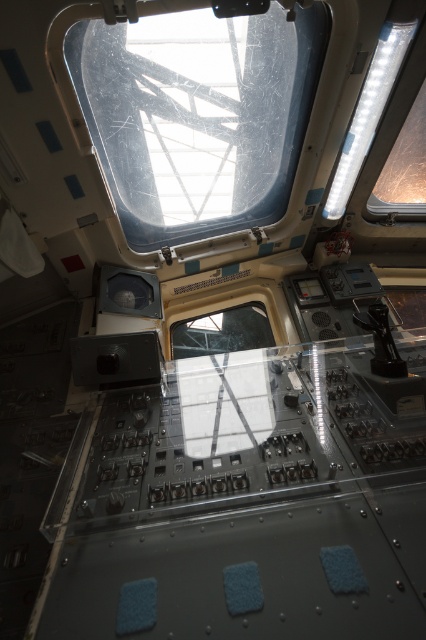
Question: Considering the real-world distances, which object is farthest from the transparent glass window at upper right?

Choices:
 (A) transparent plastic window at upper center
 (B) transparent plastic window at upper right

Answer: (A)

Question: Observing the image, what is the correct spatial positioning of transparent plastic window at upper center in reference to transparent glass window at upper right?

Choices:
 (A) above
 (B) below

Answer: (B)

Question: Which of the following is the farthest from the observer?

Choices:
 (A) (423, 182)
 (B) (356, 141)

Answer: (A)

Question: Which of the following is the farthest from the observer?

Choices:
 (A) transparent plastic window at upper right
 (B) transparent glass window at upper right

Answer: (B)

Question: Is transparent plastic window at upper center bigger than transparent plastic window at upper right?

Choices:
 (A) yes
 (B) no

Answer: (A)

Question: Can you confirm if transparent plastic window at upper center is positioned to the right of transparent glass window at upper right?

Choices:
 (A) yes
 (B) no

Answer: (B)